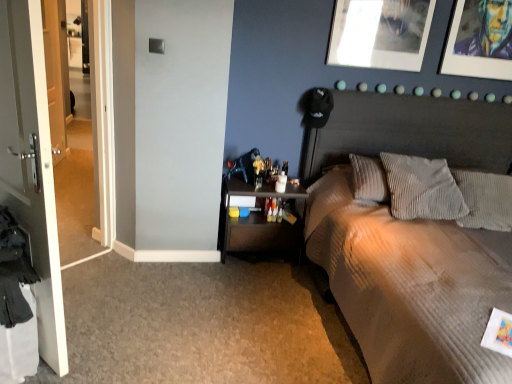
This screenshot has height=384, width=512. What are the coordinates of `vacant space behind white glossy door at left` in the screenshot? It's located at (97, 293).